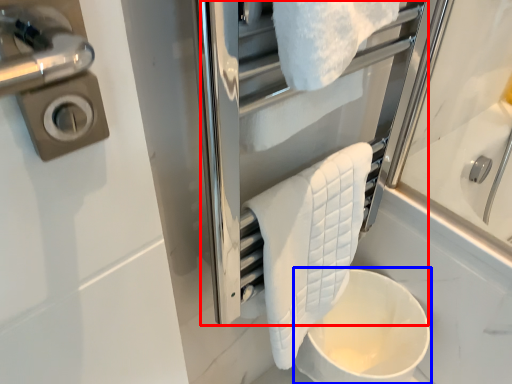
Question: Which of the following is the closest to the observer, screen door (highlighted by a red box) or toilet bowl (highlighted by a blue box)?

Choices:
 (A) screen door
 (B) toilet bowl

Answer: (A)